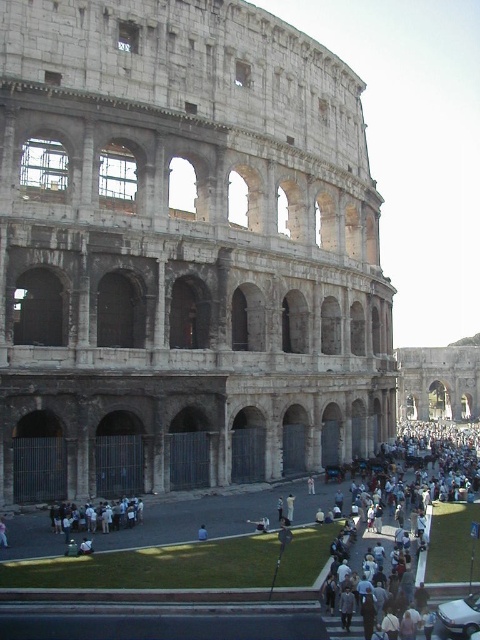
Question: Among these objects, which one is farthest from the camera?

Choices:
 (A) white cotton crowd at lower right
 (B) stone amphitheater at center
 (C) light gray stone people at lower left
 (D) light blue fabric at lower center

Answer: (B)

Question: Can you confirm if white cotton crowd at lower right is positioned below light blue fabric at lower center?

Choices:
 (A) yes
 (B) no

Answer: (A)

Question: Does stone amphitheater at center appear on the right side of white cotton crowd at lower right?

Choices:
 (A) no
 (B) yes

Answer: (A)

Question: Which point appears farthest from the camera in this image?

Choices:
 (A) (396, 528)
 (B) (200, 531)
 (C) (323, 465)

Answer: (C)

Question: Which of these objects is positioned closest to the light gray stone people at lower left?

Choices:
 (A) stone amphitheater at center
 (B) white cotton crowd at lower right

Answer: (A)

Question: Considering the relative positions of white cotton crowd at lower right and light blue fabric at lower center in the image provided, where is white cotton crowd at lower right located with respect to light blue fabric at lower center?

Choices:
 (A) below
 (B) above

Answer: (A)